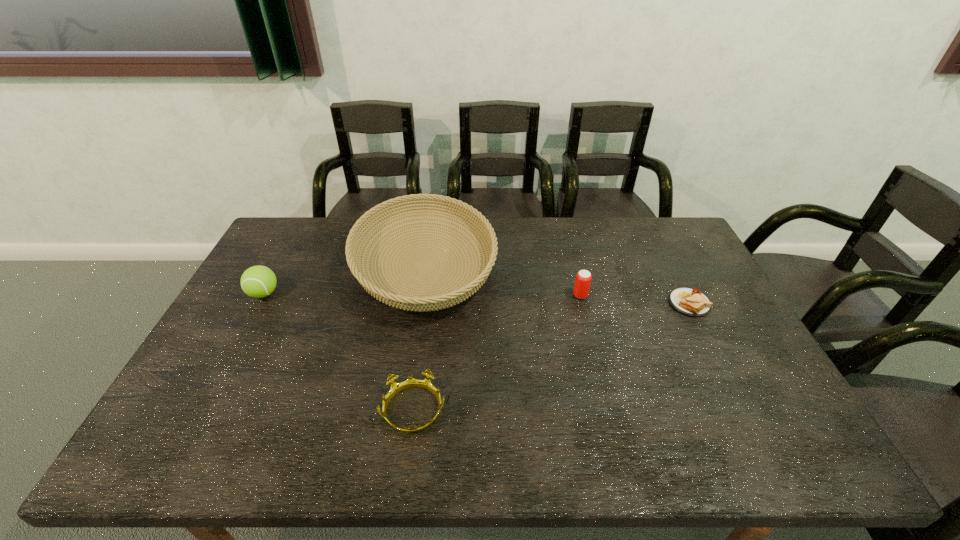
Locate an element on the screen. This screenshot has height=540, width=960. free point located 0.350m on the left of the second shortest object is located at coordinates (237, 410).

This screenshot has width=960, height=540. I want to click on vacant space located 0.150m on the back of the rightmost object, so click(x=667, y=260).

Find the location of `object that is at the far edge`. object that is at the far edge is located at coordinates (436, 298).

I want to click on object at the near edge, so click(426, 384).

I want to click on object at the left edge, so click(258, 281).

Where is `object at the right edge`? object at the right edge is located at coordinates (691, 302).

Image resolution: width=960 pixels, height=540 pixels. What are the coordinates of `vacant space at the far edge` in the screenshot? It's located at (540, 225).

Where is `vacant area at the near edge`? vacant area at the near edge is located at coordinates (393, 430).

At what (x,y) coordinates should I click in order to perform the action: click on blank space at the left edge of the desktop. Please return your answer as a coordinate pair (x, y). The width and height of the screenshot is (960, 540). Looking at the image, I should click on (215, 416).

You are a GUI agent. You are given a task and a screenshot of the screen. Output one action in this format:
    pyautogui.click(x=<x>, y=<y>)
    Task: Click on the vacant area at the right edge
    The height and width of the screenshot is (540, 960).
    Given the screenshot: What is the action you would take?
    pyautogui.click(x=679, y=261)